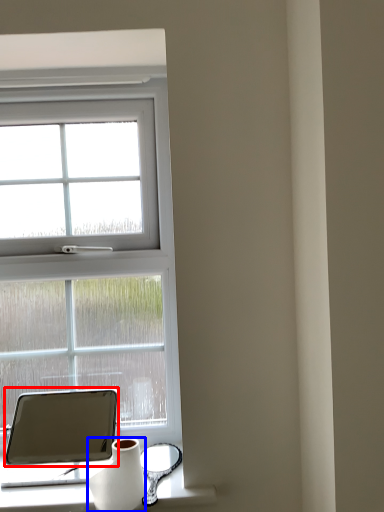
Question: Which of the following is the closest to the observer, tablet computer (highlighted by a red box) or vase (highlighted by a blue box)?

Choices:
 (A) tablet computer
 (B) vase

Answer: (B)